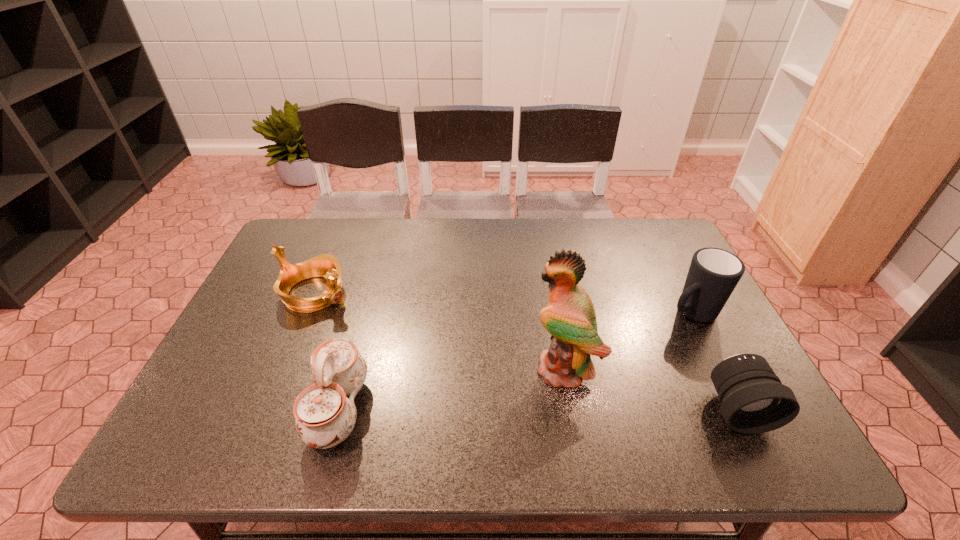
The image size is (960, 540). What are the coordinates of `vacant spot on the desktop that is between the chinaware and the telephoto lens and is positioned at the front emblem of the tiara` in the screenshot? It's located at (x=560, y=409).

Locate an element on the screen. The height and width of the screenshot is (540, 960). free spot on the desktop that is between the chinaware and the telephoto lens and is positioned on the side of the mug with the handle is located at coordinates (532, 409).

Where is `free space on the desktop that is between the chinaware and the telephoto lens and is positioned on the front-facing side of the parrot`? This screenshot has height=540, width=960. free space on the desktop that is between the chinaware and the telephoto lens and is positioned on the front-facing side of the parrot is located at coordinates (479, 409).